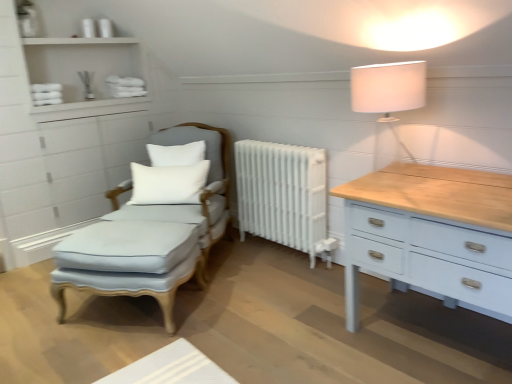
I want to click on vacant space situated on the left part of white painted radiator at center, so click(242, 258).